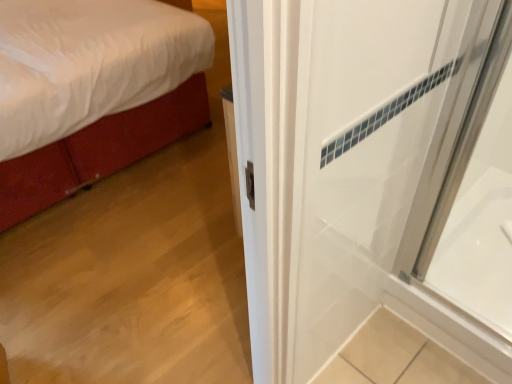
Where is `white glossy bathtub at right`? The height and width of the screenshot is (384, 512). white glossy bathtub at right is located at coordinates (478, 249).

What do you see at coordinates (478, 249) in the screenshot? This screenshot has height=384, width=512. I see `white glossy bathtub at right` at bounding box center [478, 249].

The height and width of the screenshot is (384, 512). What do you see at coordinates (92, 92) in the screenshot? I see `velvet red bed at left` at bounding box center [92, 92].

Where is `velvet red bed at left`? The height and width of the screenshot is (384, 512). velvet red bed at left is located at coordinates (92, 92).

At what (x,y) coordinates should I click in order to perform the action: click on white glossy bathtub at right. Please return your answer as a coordinate pair (x, y). Looking at the image, I should click on (478, 249).

Which object is positioned more to the right, velvet red bed at left or white glossy bathtub at right?

From the viewer's perspective, white glossy bathtub at right appears more on the right side.

Which object is more forward, velvet red bed at left or white glossy bathtub at right?

white glossy bathtub at right is in front.

Considering the points (52, 132) and (504, 315), which point is in front, point (52, 132) or point (504, 315)?

The point (504, 315) is in front.

From the image's perspective, does velvet red bed at left appear lower than white glossy bathtub at right?

Actually, velvet red bed at left appears above white glossy bathtub at right in the image.

From a real-world perspective, is velvet red bed at left above or below white glossy bathtub at right?

Clearly, from a real-world perspective, velvet red bed at left is above white glossy bathtub at right.

Looking at their sizes, would you say velvet red bed at left is wider or thinner than white glossy bathtub at right?

Considering their sizes, velvet red bed at left looks broader than white glossy bathtub at right.

Is velvet red bed at left taller than white glossy bathtub at right?

Yes.

Who is bigger, velvet red bed at left or white glossy bathtub at right?

Bigger between the two is velvet red bed at left.

Do you think velvet red bed at left is within white glossy bathtub at right, or outside of it?

velvet red bed at left is not enclosed by white glossy bathtub at right.

Is velvet red bed at left beside white glossy bathtub at right?

No, velvet red bed at left is not with white glossy bathtub at right.

Is velvet red bed at left oriented towards white glossy bathtub at right?

Yes, velvet red bed at left is turned towards white glossy bathtub at right.

Identify the location of bath beneath the velvet red bed at left (from a real-world perspective). Image resolution: width=512 pixels, height=384 pixels. pos(478,249).

Which object is positioned more to the right, white glossy bathtub at right or velvet red bed at left?

Positioned to the right is white glossy bathtub at right.

Considering the relative positions of white glossy bathtub at right and velvet red bed at left in the image provided, is white glossy bathtub at right behind velvet red bed at left?

No, white glossy bathtub at right is closer to the viewer.

Does point (483, 192) appear closer or farther from the camera than point (14, 100)?

Point (483, 192) appears to be farther away from the viewer than point (14, 100).

From the image's perspective, is white glossy bathtub at right positioned above or below velvet red bed at left?

white glossy bathtub at right is below velvet red bed at left.

From a real-world perspective, between white glossy bathtub at right and velvet red bed at left, who is vertically higher?

velvet red bed at left.

Which of these two, white glossy bathtub at right or velvet red bed at left, is thinner?

white glossy bathtub at right.

Considering the sizes of white glossy bathtub at right and velvet red bed at left in the image, is white glossy bathtub at right taller or shorter than velvet red bed at left?

Considering their sizes, white glossy bathtub at right has less height than velvet red bed at left.

Does white glossy bathtub at right have a smaller size compared to velvet red bed at left?

Yes, white glossy bathtub at right is smaller than velvet red bed at left.

Is white glossy bathtub at right not inside velvet red bed at left?

white glossy bathtub at right lies outside velvet red bed at left's area.

Is white glossy bathtub at right beside velvet red bed at left?

There is a gap between white glossy bathtub at right and velvet red bed at left.

Is white glossy bathtub at right aimed at velvet red bed at left?

No, white glossy bathtub at right is not facing towards velvet red bed at left.

How different are the orientations of white glossy bathtub at right and velvet red bed at left in degrees?

90.4 degrees.

Find the location of a particular element. The image size is (512, 384). bath on the right of velvet red bed at left is located at coordinates (478, 249).

In order to click on bed above the white glossy bathtub at right (from a real-world perspective) in this screenshot , I will do `click(92, 92)`.

Locate an element on the screen. Image resolution: width=512 pixels, height=384 pixels. bath that is in front of the velvet red bed at left is located at coordinates (478, 249).